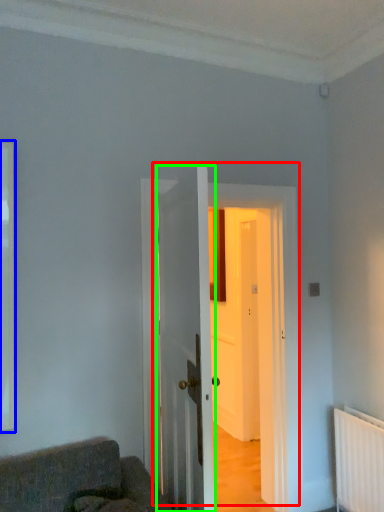
Question: Based on their relative distances, which object is nearer to door (highlighted by a red box)? Choose from window (highlighted by a blue box) and door (highlighted by a green box).

Choices:
 (A) window
 (B) door

Answer: (B)